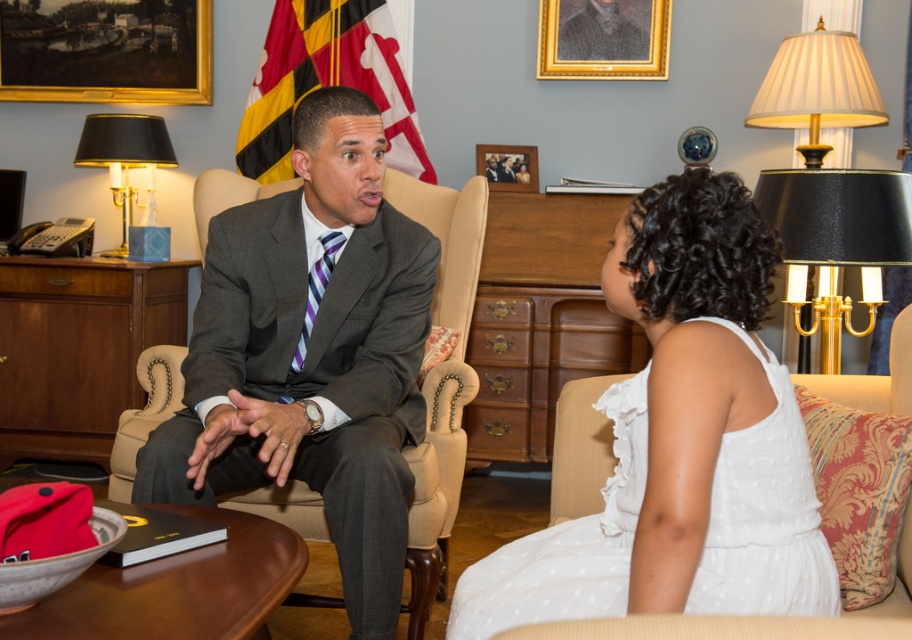
Question: Estimate the real-world distances between objects in this image. Which object is closer to the wooden picture frame at upper center?

Choices:
 (A) gold-framed painting at upper left
 (B) white dotted dress at center

Answer: (A)

Question: Which object appears farthest from the camera in this image?

Choices:
 (A) gold-framed painting at upper left
 (B) wooden picture frame at upper center

Answer: (A)

Question: Considering the real-world distances, which object is closest to the white dotted dress at center?

Choices:
 (A) wooden picture frame at upper center
 (B) gold-framed painting at upper left
 (C) black fabric lampshade at left
 (D) gold-framed portrait at upper center

Answer: (A)

Question: Is gold-framed painting at upper left behind wooden picture frame at upper center?

Choices:
 (A) yes
 (B) no

Answer: (A)

Question: Is white dotted dress at center above wooden picture frame at upper center?

Choices:
 (A) yes
 (B) no

Answer: (B)

Question: Where is white dotted dress at center located in relation to black fabric lampshade at left in the image?

Choices:
 (A) left
 (B) right

Answer: (B)